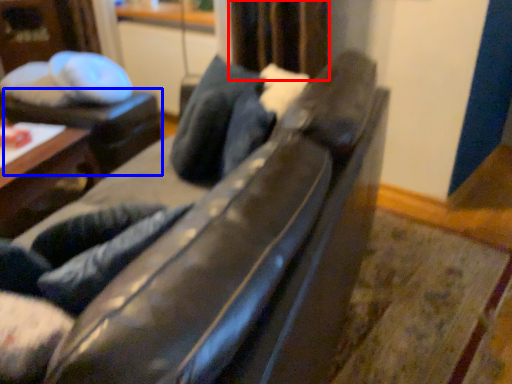
Question: Which of the following is the farthest to the observer, curtain (highlighted by a red box) or table (highlighted by a blue box)?

Choices:
 (A) curtain
 (B) table

Answer: (B)